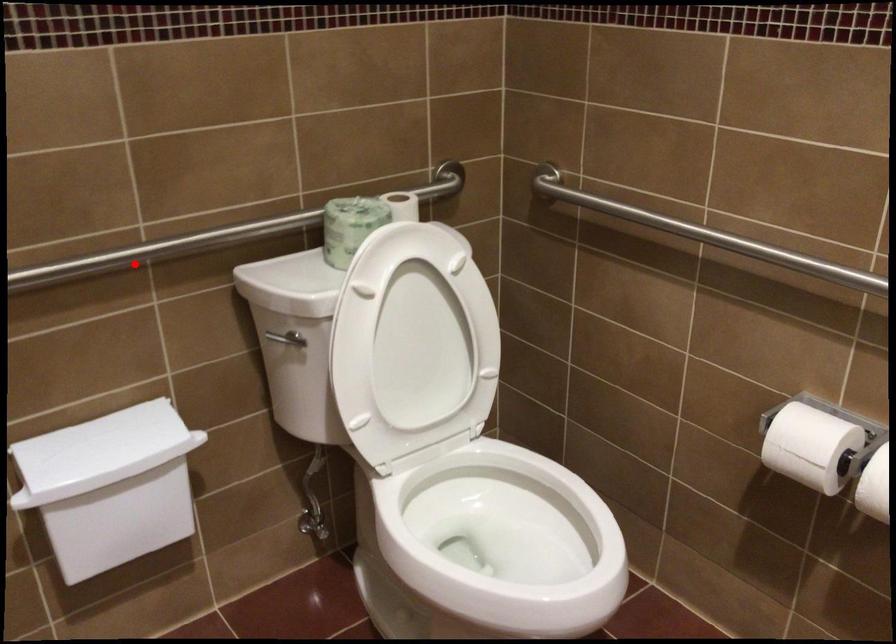
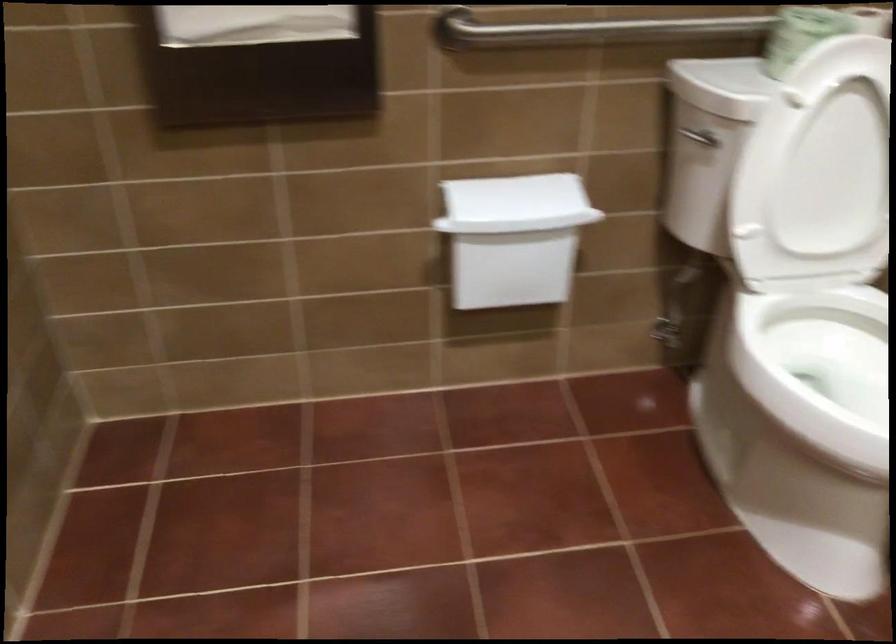
The point at the highlighted location is marked in the first image. Where is the corresponding point in the second image?

(586, 31)